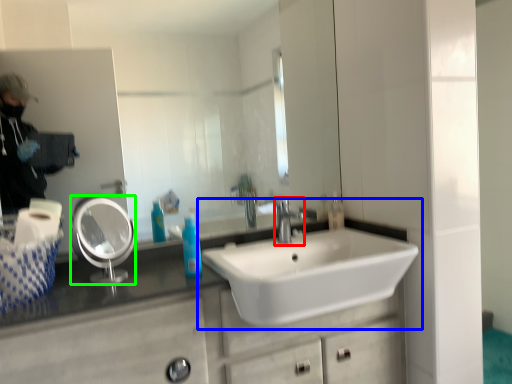
Question: Which object is the closest to the tap (highlighted by a red box)? Choose among these: sink (highlighted by a blue box) or mirror (highlighted by a green box).

Choices:
 (A) sink
 (B) mirror

Answer: (A)